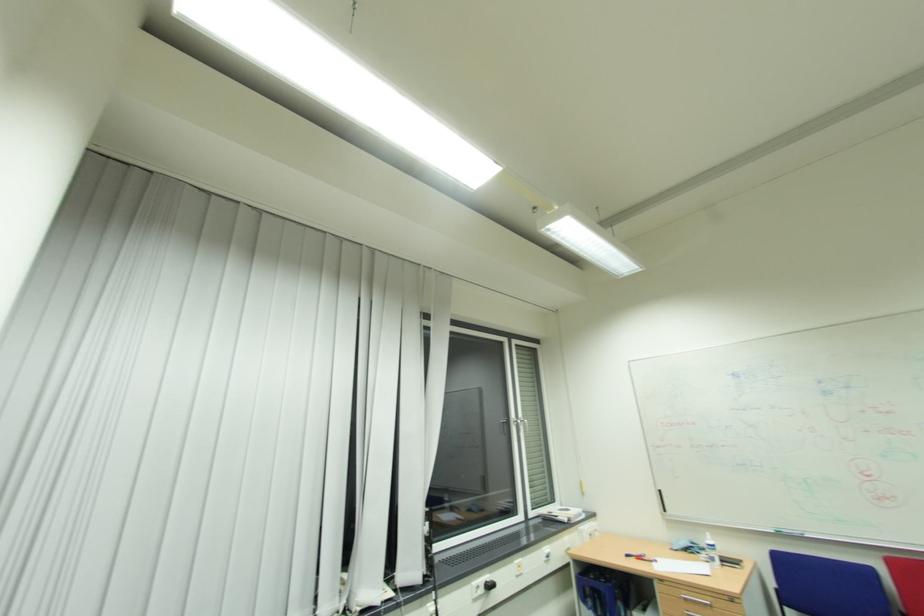
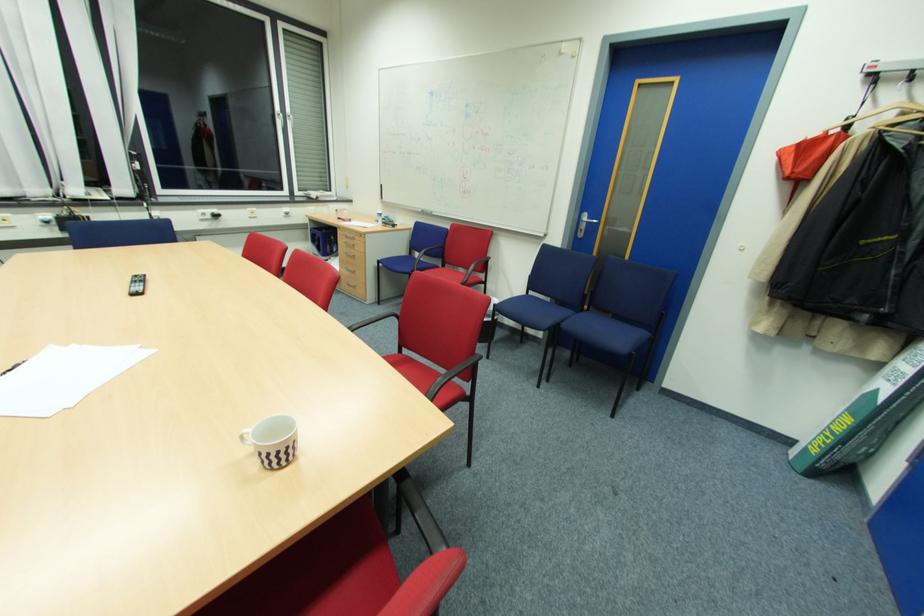
In the second image, find the point that corresponds to pixel 494 586 in the first image.

(220, 216)